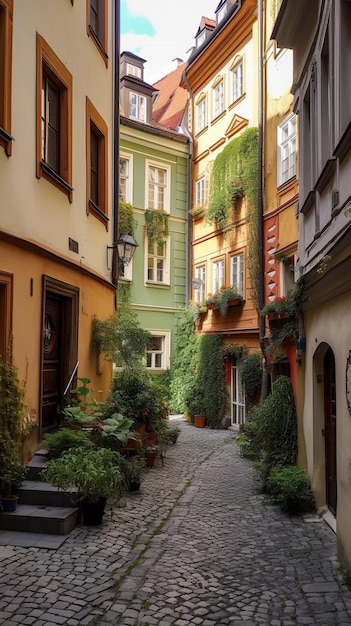
Where is `light`? The image size is (351, 626). light is located at coordinates (125, 254).